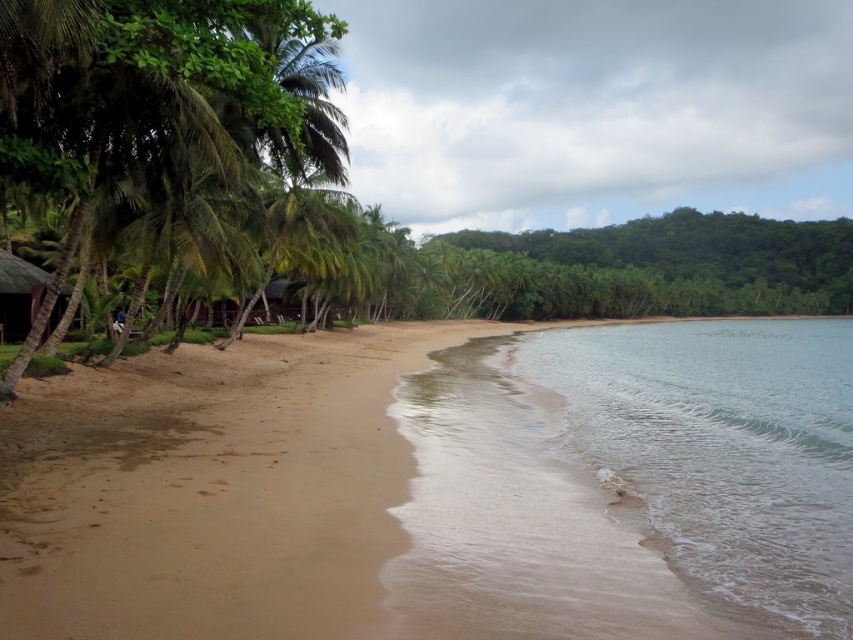
Question: Which object is positioned farthest from the dark brown wooden hut at left?

Choices:
 (A) clear water at lower right
 (B) brown sandy beach at center

Answer: (A)

Question: Where is brown sandy beach at center located in relation to dark brown wooden hut at left in the image?

Choices:
 (A) above
 (B) below

Answer: (B)

Question: Which object is closer to the camera taking this photo?

Choices:
 (A) clear water at lower right
 (B) brown sandy beach at center
 (C) dark brown wooden hut at left

Answer: (B)

Question: Which point appears farthest from the camera in this image?

Choices:
 (A) (735, 588)
 (B) (184, 365)
 (C) (10, 269)

Answer: (C)

Question: Is brown sandy beach at center positioned behind dark brown wooden hut at left?

Choices:
 (A) no
 (B) yes

Answer: (A)

Question: Can you confirm if brown sandy beach at center is smaller than clear water at lower right?

Choices:
 (A) no
 (B) yes

Answer: (B)